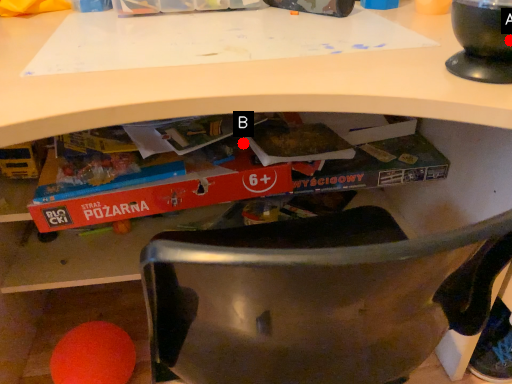
Question: Two points are circled on the image, labeled by A and B beside each circle. Which point appears farthest from the camera in this image?

Choices:
 (A) A is further
 (B) B is further

Answer: (B)